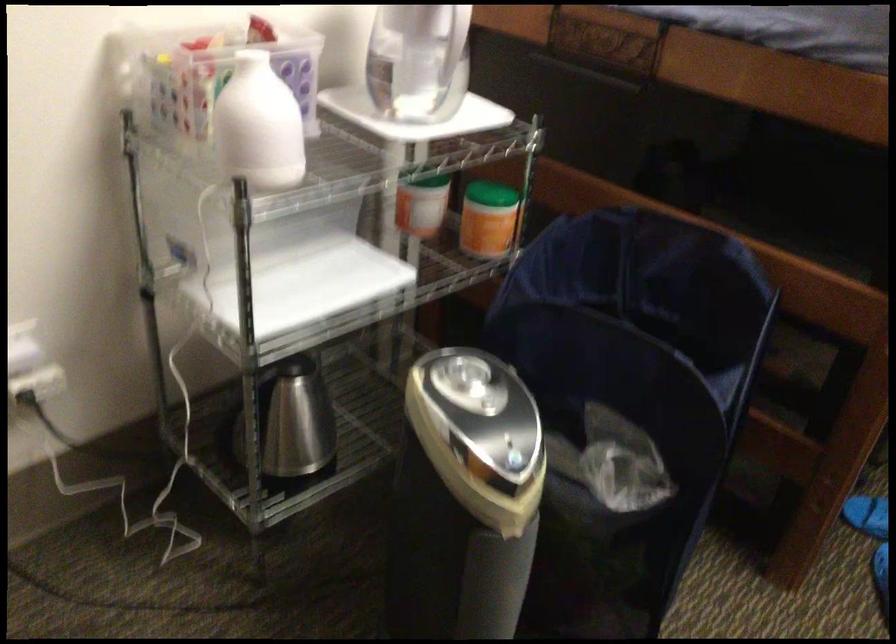
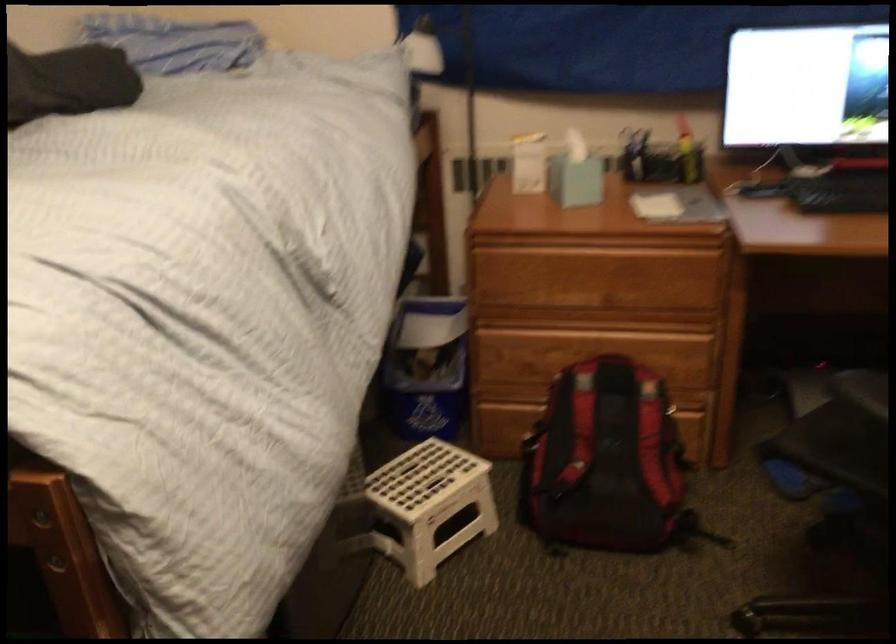
Question: The images are taken continuously from a first-person perspective. In which direction is your viewpoint rotating?

Choices:
 (A) Left
 (B) Right
 (C) Up
 (D) Down

Answer: (B)